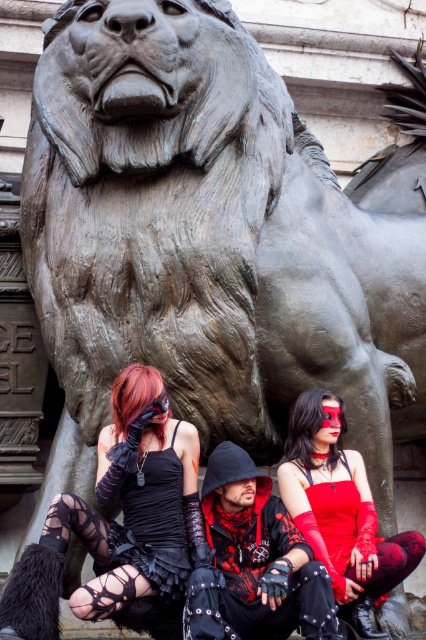
Is the position of matte black dress at center more distant than that of matte red dress at center?

That is False.

Is point (137, 541) positioned before point (391, 568)?

Yes, it is.

Find the location of a particular element. matte black dress at center is located at coordinates (120, 525).